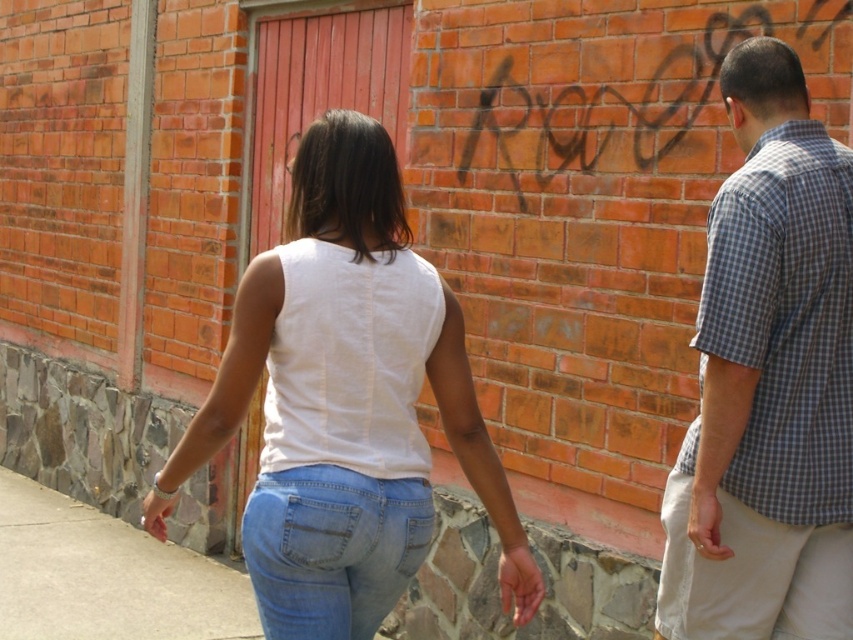
Who is more forward, (x=848, y=410) or (x=80, y=605)?

Point (x=848, y=410) is more forward.

Can you confirm if checkered fabric shirt at right is taller than gray concrete pavement at lower left?

Yes.

Who is more distant from viewer, (675, 504) or (67, 600)?

Point (67, 600)

Identify the location of checkered fabric shirt at right. (769, 381).

Is gray concrete pavement at lower left bigger than light blue denim jeans at center?

Indeed, gray concrete pavement at lower left has a larger size compared to light blue denim jeans at center.

Measure the distance between gray concrete pavement at lower left and camera.

gray concrete pavement at lower left is 13.34 feet from camera.

The height and width of the screenshot is (640, 853). Describe the element at coordinates (106, 577) in the screenshot. I see `gray concrete pavement at lower left` at that location.

This screenshot has height=640, width=853. I want to click on gray concrete pavement at lower left, so click(106, 577).

Is checkered fabric shirt at right bigger than light blue denim jeans at center?

Indeed, checkered fabric shirt at right has a larger size compared to light blue denim jeans at center.

Is point (770, 538) closer to camera compared to point (392, 512)?

That is False.

What do you see at coordinates (769, 381) in the screenshot?
I see `checkered fabric shirt at right` at bounding box center [769, 381].

This screenshot has width=853, height=640. In order to click on checkered fabric shirt at right in this screenshot , I will do `click(769, 381)`.